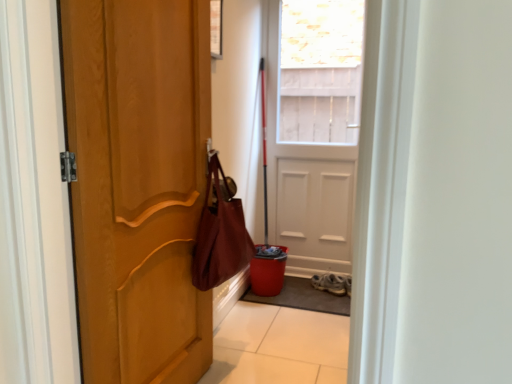
Question: Considering the positions of point (181, 205) and point (333, 284), is point (181, 205) closer or farther from the camera than point (333, 284)?

Choices:
 (A) farther
 (B) closer

Answer: (B)

Question: Is matte wood door at left, marked as the 1th door in a front-to-back arrangement, taller or shorter than white leather sneakers at lower center?

Choices:
 (A) tall
 (B) short

Answer: (A)

Question: Which of these objects is positioned closest to the white leather sneakers at lower center?

Choices:
 (A) gray textured mat at lower center
 (B) leather-like maroon shoulder bag at center-left
 (C) white matte door at center, acting as the 1th door starting from the right
 (D) matte wood door at left, the 1th door in the left-to-right sequence

Answer: (A)

Question: Based on their relative distances, which object is nearer to the leather-like maroon shoulder bag at center-left?

Choices:
 (A) white leather sneakers at lower center
 (B) matte wood door at left, which ranks as the 2th door in back-to-front order
 (C) gray textured mat at lower center
 (D) white matte door at center, which is the first door from back to front

Answer: (B)